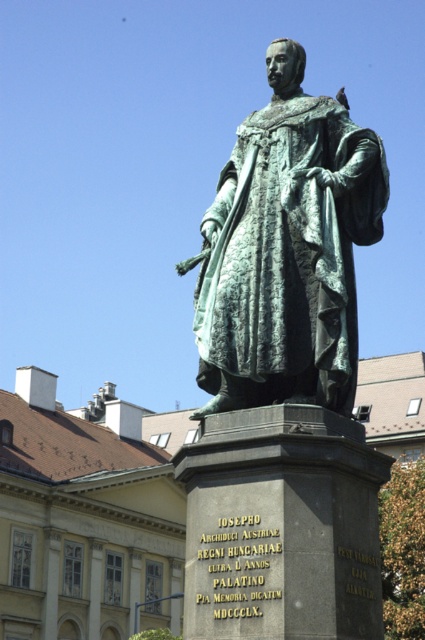
What is the relationship between the green patina statue at center and the green patina bronze statue at center in terms of their positioning?

The green patina bronze statue at center is behind the green patina statue at center.